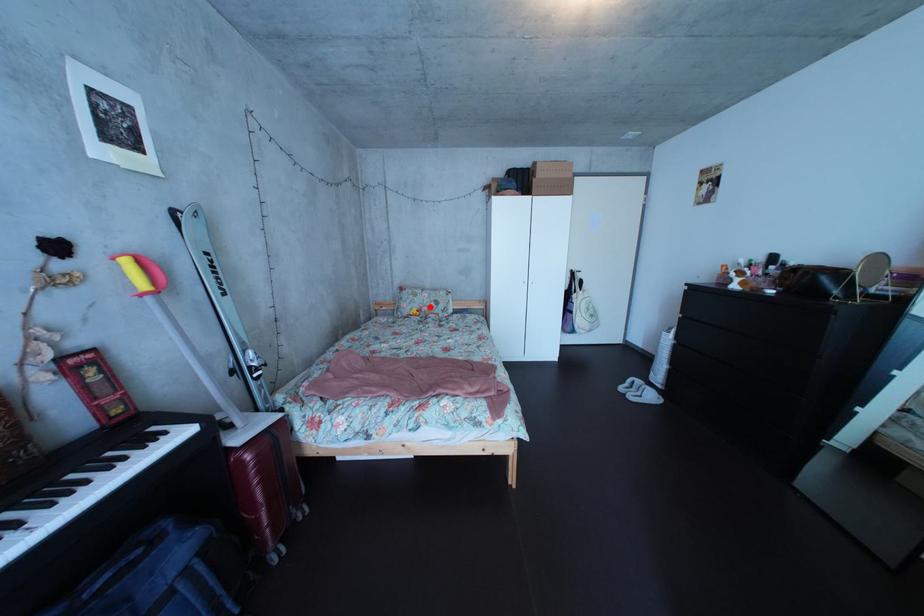
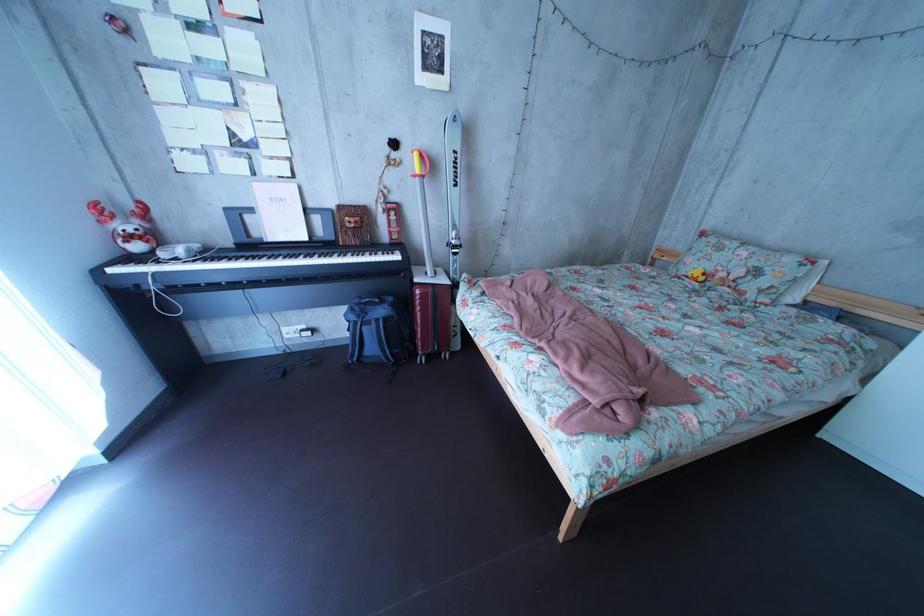
The point at the highlighted location is marked in the first image. Where is the corresponding point in the second image?

(731, 262)